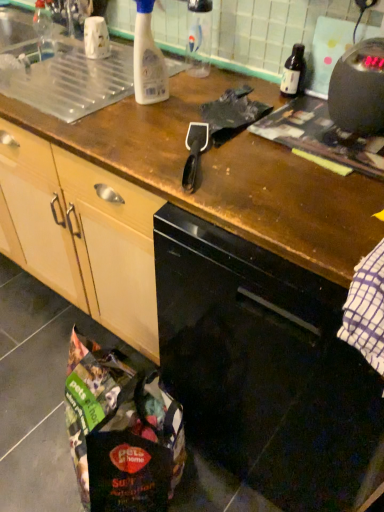
I want to click on free area in between translucent plastic spray bottle at upper center, arranged as the first bottle when viewed from the left, and black plastic spatula at center, so click(x=161, y=132).